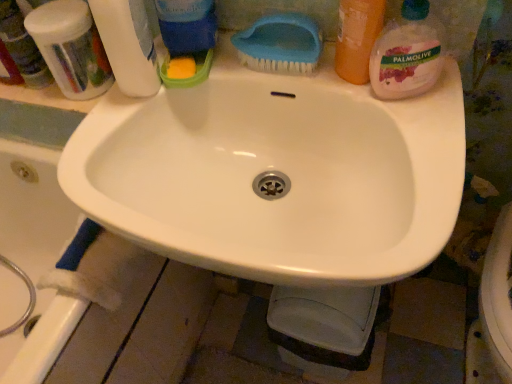
The width and height of the screenshot is (512, 384). In order to click on vacant area that is in front of white plastic bottle at upper left, the 1th cleaning product from the left in this screenshot , I will do `click(104, 146)`.